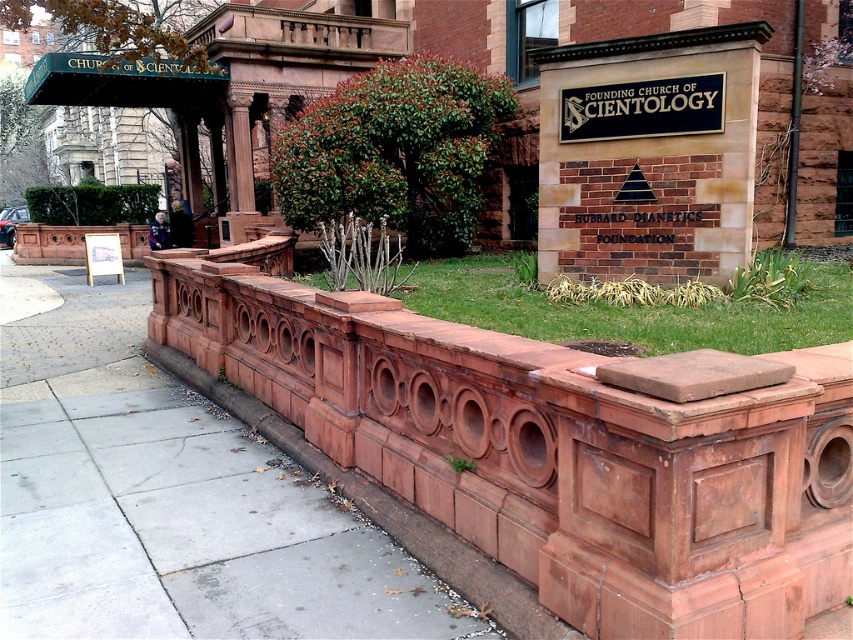
You are a visitor approaching the Founding Church of Scientology. You notice a terracotta stone curb at lower center and a white wood sign at center. Which object is wider?

The terracotta stone curb at lower center is wider than the white wood sign at center.

You are a visitor approaching the Founding Church of Scientology. You see a terracotta stone curb at lower center and a black metal sign at upper center. Which object is larger in size?

The black metal sign at upper center is larger than the terracotta stone curb at lower center.

You are a visitor approaching the Founding Church of Scientology. You see a terracotta stone curb at lower center and a white wood sign at center. Which object is larger?

The white wood sign at center is larger than the terracotta stone curb at lower center.